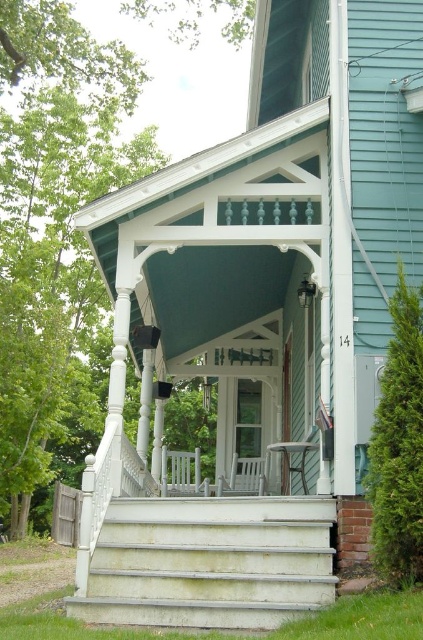
What do you see at coordinates (208, 563) in the screenshot? I see `gray concrete stairs at center` at bounding box center [208, 563].

Is point (167, 579) positioned behind point (236, 476)?

No.

Between point (175, 612) and point (261, 480), which one is positioned behind?

The point (261, 480) is more distant.

The image size is (423, 640). In order to click on gray concrete stairs at center in this screenshot , I will do `click(208, 563)`.